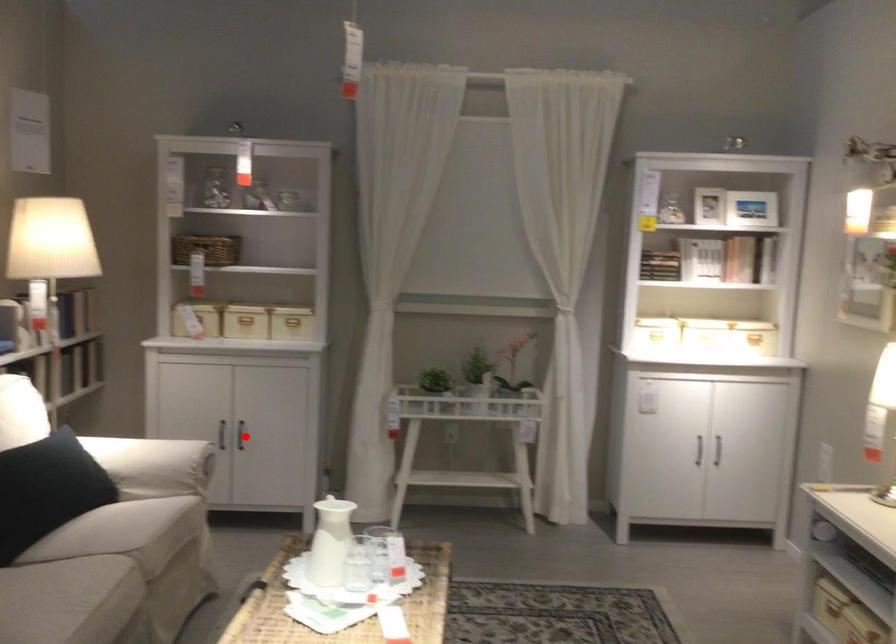
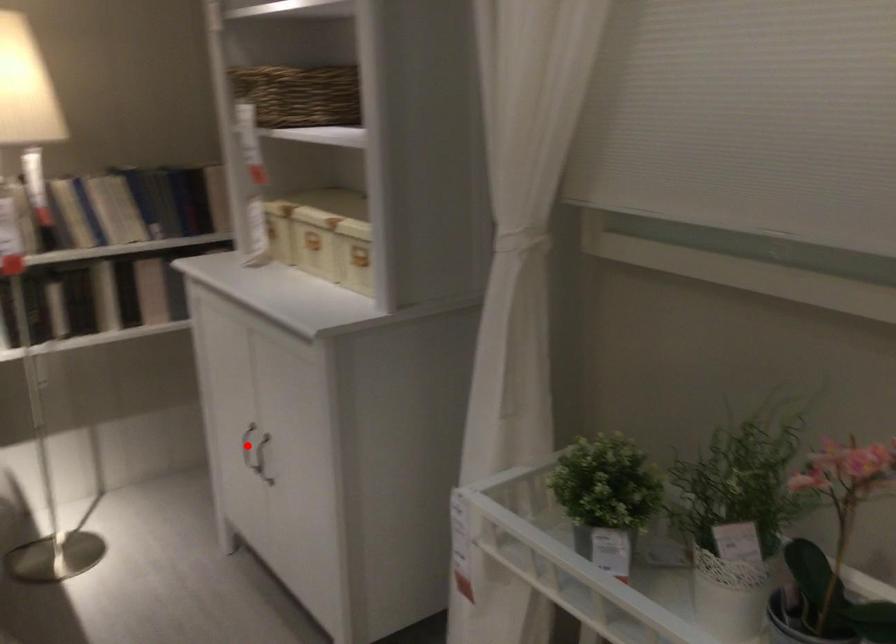
I am providing you with two images of the same scene from different viewpoints. A red point is marked on the first image and another point is marked on the second image. Is the marked point in image1 the same physical position as the marked point in image2?

No